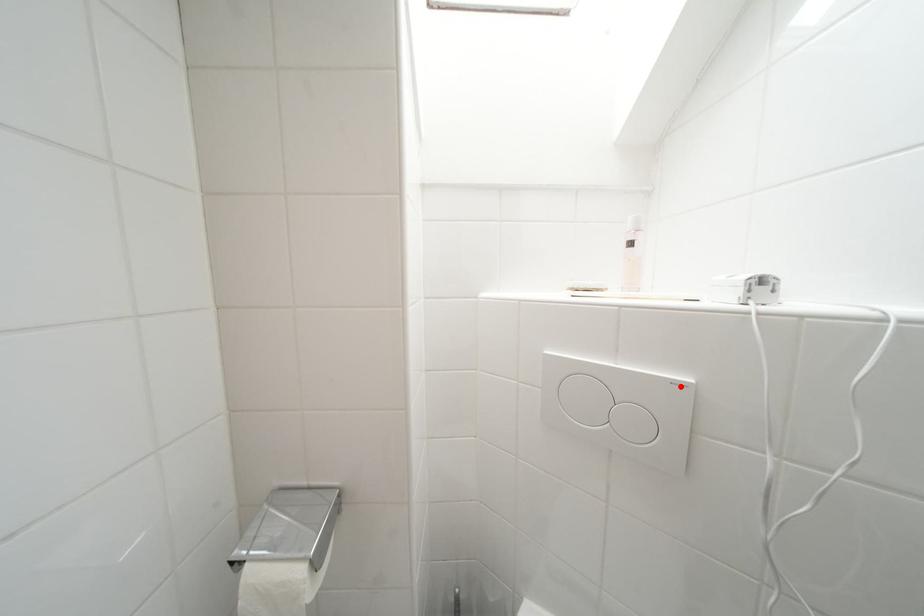
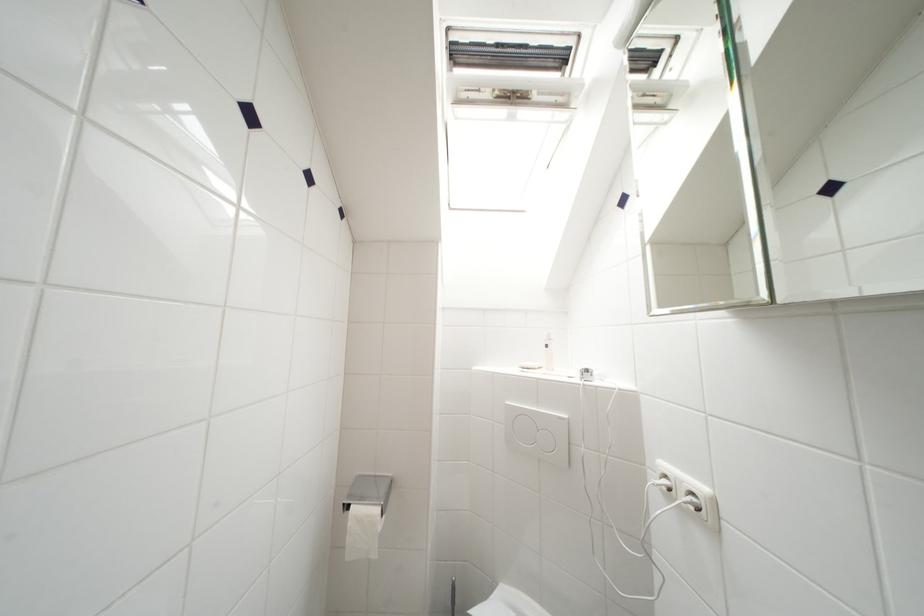
The point at the highlighted location is marked in the first image. Where is the corresponding point in the second image?

(565, 421)